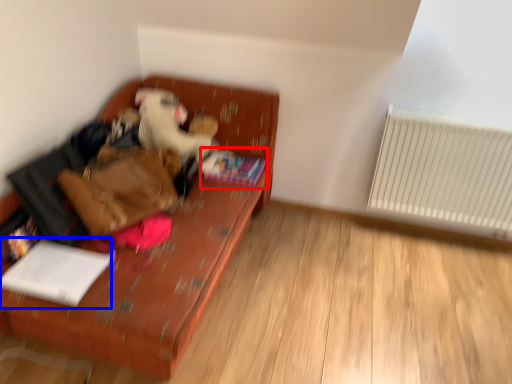
Question: Which object appears farthest to the camera in this image, book (highlighted by a red box) or book (highlighted by a blue box)?

Choices:
 (A) book
 (B) book

Answer: (A)